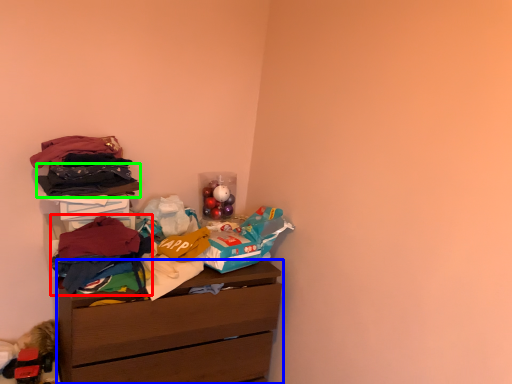
Question: Which object is positioned farthest from clothing (highlighted by a red box)? Select from chest of drawers (highlighted by a blue box) and clothing (highlighted by a green box).

Choices:
 (A) chest of drawers
 (B) clothing

Answer: (A)